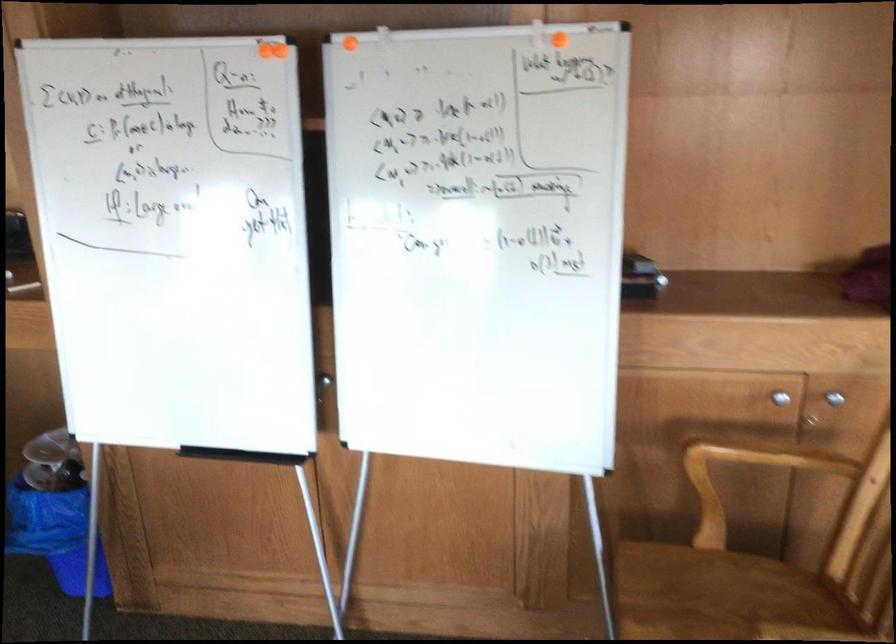
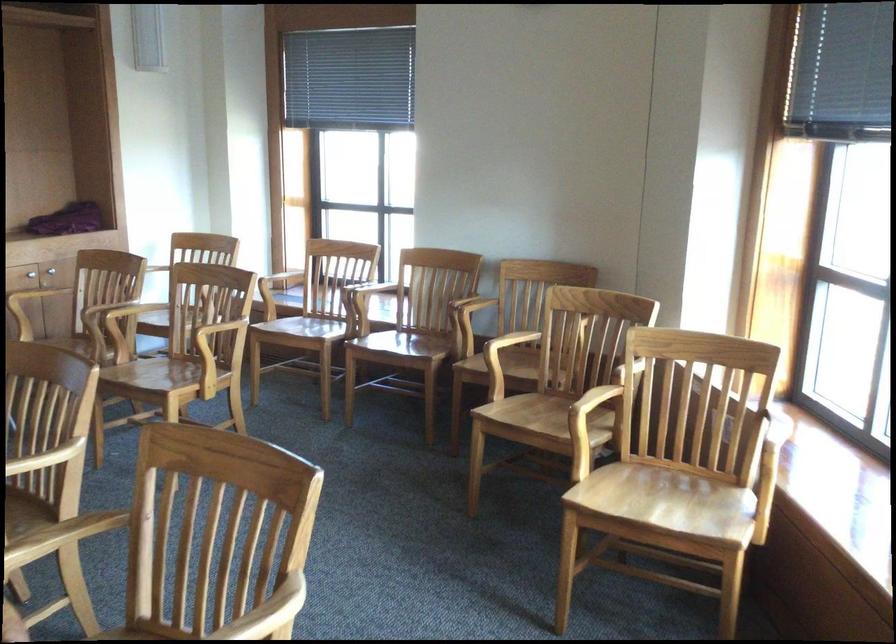
The point at (x=798, y=381) is marked in the first image. Where is the corresponding point in the second image?

(31, 272)